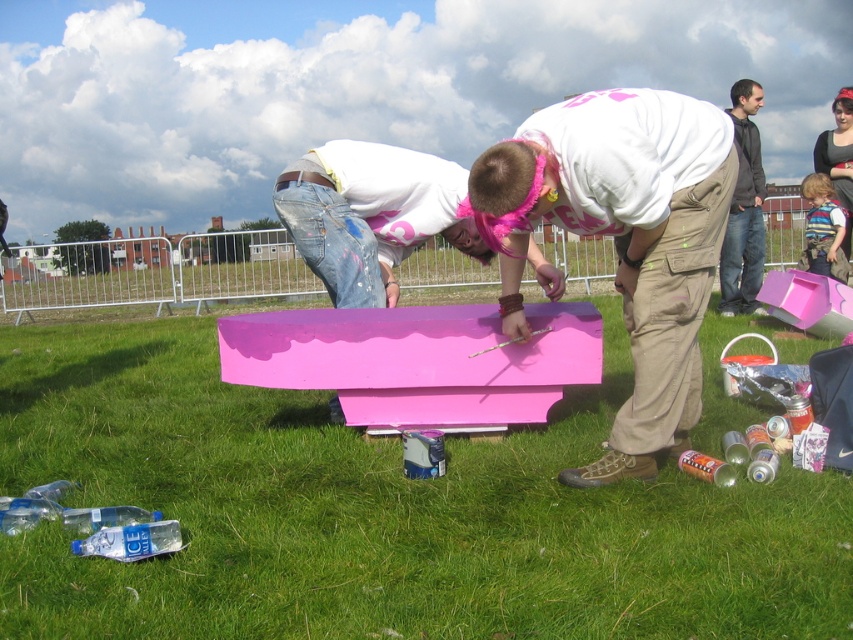
Question: Considering the real-world distances, which object is farthest from the matte black jacket at upper right?

Choices:
 (A) pink matte paint can at center
 (B) pink matte coffin at center
 (C) matte pink shirt at center

Answer: (B)

Question: Which object is positioned farthest from the pink matte paint can at center?

Choices:
 (A) pink matte coffin at center
 (B) pink matte wood at center
 (C) matte black jacket at upper right

Answer: (C)

Question: Where is pink matte wood at center located in relation to pink matte paint can at center in the image?

Choices:
 (A) left
 (B) right

Answer: (B)

Question: Can you confirm if pink matte coffin at center is bigger than pink matte paint can at center?

Choices:
 (A) no
 (B) yes

Answer: (A)

Question: Is green grass at center positioned behind pink matte paint can at center?

Choices:
 (A) no
 (B) yes

Answer: (A)

Question: Among these points, which one is nearest to the camera?

Choices:
 (A) (451, 214)
 (B) (416, 342)
 (C) (846, 113)
 (D) (675, 340)

Answer: (D)